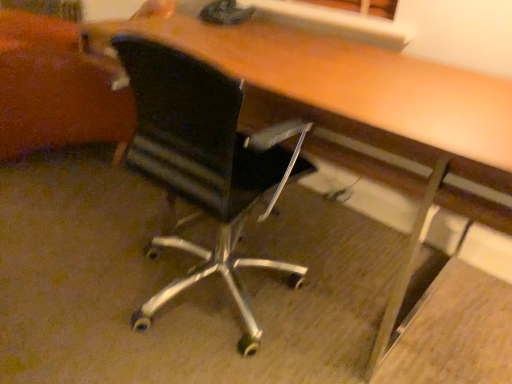
Question: Based on their positions, is black leather chair at center located to the left or right of black mesh swivel chair at left?

Choices:
 (A) right
 (B) left

Answer: (A)

Question: Looking at the image, does black leather chair at center seem bigger or smaller compared to black mesh swivel chair at left?

Choices:
 (A) big
 (B) small

Answer: (B)

Question: From the image's perspective, relative to black mesh swivel chair at left, is black leather chair at center above or below?

Choices:
 (A) below
 (B) above

Answer: (A)

Question: Is black mesh swivel chair at left wider or thinner than black leather chair at center?

Choices:
 (A) thin
 (B) wide

Answer: (B)

Question: Based on their sizes in the image, would you say black mesh swivel chair at left is bigger or smaller than black leather chair at center?

Choices:
 (A) small
 (B) big

Answer: (B)

Question: Is black mesh swivel chair at left spatially inside black leather chair at center, or outside of it?

Choices:
 (A) outside
 (B) inside

Answer: (A)

Question: In terms of height, does black mesh swivel chair at left look taller or shorter compared to black leather chair at center?

Choices:
 (A) short
 (B) tall

Answer: (A)